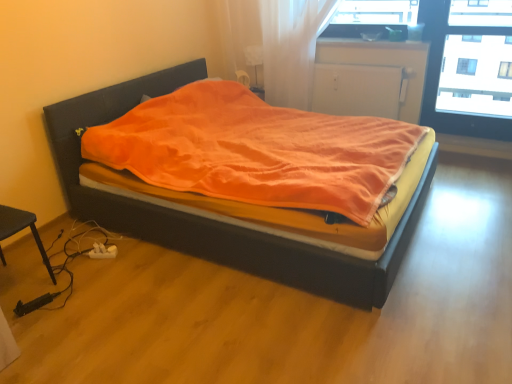
Question: Should I look upward or downward to see white matte radiator at upper center?

Choices:
 (A) up
 (B) down

Answer: (A)

Question: Is velvet orange blanket at center oriented towards smooth wood window sill at right?

Choices:
 (A) no
 (B) yes

Answer: (A)

Question: Is velvet orange blanket at center far away from smooth wood window sill at right?

Choices:
 (A) no
 (B) yes

Answer: (B)

Question: Can you confirm if velvet orange blanket at center is smaller than smooth wood window sill at right?

Choices:
 (A) yes
 (B) no

Answer: (B)

Question: Can you confirm if velvet orange blanket at center is positioned to the left of smooth wood window sill at right?

Choices:
 (A) yes
 (B) no

Answer: (A)

Question: Is the depth of velvet orange blanket at center less than that of smooth wood window sill at right?

Choices:
 (A) yes
 (B) no

Answer: (A)

Question: From the image's perspective, is velvet orange blanket at center below smooth wood window sill at right?

Choices:
 (A) yes
 (B) no

Answer: (A)

Question: Is white matte radiator at upper center positioned with its back to velvet orange blanket at center?

Choices:
 (A) yes
 (B) no

Answer: (B)

Question: Is white matte radiator at upper center facing towards velvet orange blanket at center?

Choices:
 (A) no
 (B) yes

Answer: (B)

Question: Is white matte radiator at upper center thinner than velvet orange blanket at center?

Choices:
 (A) no
 (B) yes

Answer: (B)

Question: Can you confirm if white matte radiator at upper center is smaller than velvet orange blanket at center?

Choices:
 (A) no
 (B) yes

Answer: (B)

Question: From a real-world perspective, is white matte radiator at upper center positioned over velvet orange blanket at center based on gravity?

Choices:
 (A) yes
 (B) no

Answer: (A)

Question: Does white matte radiator at upper center appear on the right side of velvet orange blanket at center?

Choices:
 (A) yes
 (B) no

Answer: (A)

Question: Is smooth wood window sill at right not inside white matte radiator at upper center?

Choices:
 (A) yes
 (B) no

Answer: (A)